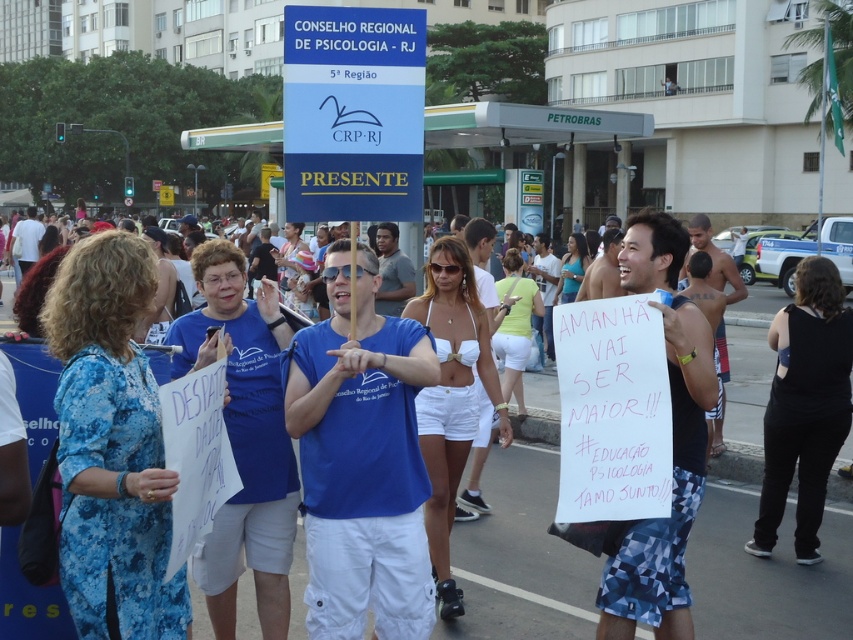
Does white paper sign at center have a greater width compared to blue plastic sign at upper center?

Yes.

Does white paper sign at center come in front of blue plastic sign at upper center?

That is True.

What are the coordinates of `white paper sign at center` in the screenshot? It's located at (521, 550).

Where is `white paper sign at center`? Image resolution: width=853 pixels, height=640 pixels. white paper sign at center is located at coordinates (521, 550).

Is blue cotton shirt at center to the left of blue plastic sign at upper center from the viewer's perspective?

Yes, blue cotton shirt at center is to the left of blue plastic sign at upper center.

Can you confirm if blue cotton shirt at center is thinner than blue plastic sign at upper center?

Incorrect, blue cotton shirt at center's width is not less than blue plastic sign at upper center's.

The image size is (853, 640). I want to click on blue cotton shirt at center, so click(361, 461).

Can you confirm if white paper sign at center is shorter than blue cotton shirt at center?

In fact, white paper sign at center may be taller than blue cotton shirt at center.

Does white paper sign at center have a greater height compared to blue cotton shirt at center?

Yes, white paper sign at center is taller than blue cotton shirt at center.

This screenshot has height=640, width=853. Describe the element at coordinates (521, 550) in the screenshot. I see `white paper sign at center` at that location.

Identify the location of white paper sign at center. (521, 550).